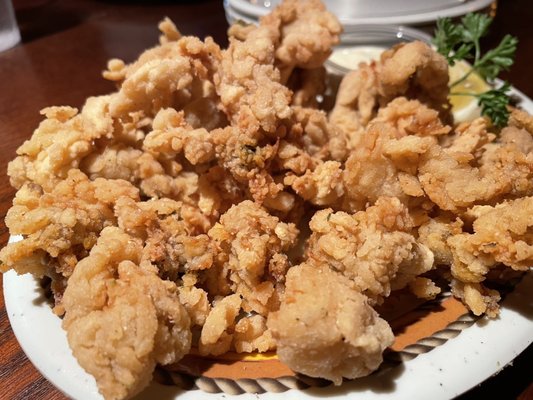
This screenshot has width=533, height=400. What are the coordinates of `plate` in the screenshot? It's located at (436, 356).